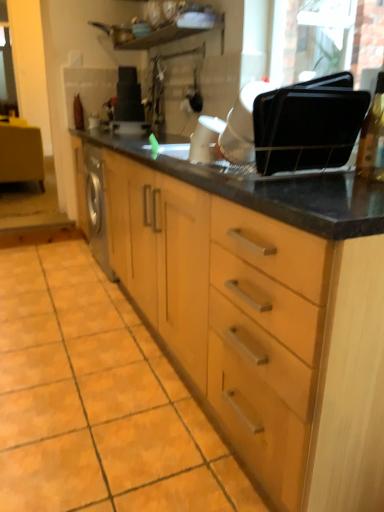
Question: Would you say black matte toaster at upper center, which appears as the third appliance when ordered from the bottom, is part of matte wood vanity at left's contents?

Choices:
 (A) yes
 (B) no

Answer: (B)

Question: Does matte wood vanity at left lie behind black matte toaster at upper center, which appears as the 1th appliance when viewed from the top?

Choices:
 (A) yes
 (B) no

Answer: (A)

Question: Is matte wood vanity at left wider than black matte toaster at upper center, which is the third appliance from front to back?

Choices:
 (A) no
 (B) yes

Answer: (B)

Question: Is the position of matte wood vanity at left less distant than that of black matte toaster at upper center, the 3th appliance positioned from the right?

Choices:
 (A) yes
 (B) no

Answer: (B)

Question: Are matte wood vanity at left and black matte toaster at upper center, the 3th appliance positioned from the right, beside each other?

Choices:
 (A) yes
 (B) no

Answer: (B)

Question: From a real-world perspective, is matte wood vanity at left on black matte toaster at upper center, the 3th appliance positioned from the right?

Choices:
 (A) no
 (B) yes

Answer: (A)

Question: Is white glossy coffee maker at center, placed as the second appliance when sorted from right to left, wider than matte wood vanity at left?

Choices:
 (A) yes
 (B) no

Answer: (B)

Question: Considering the relative sizes of white glossy coffee maker at center, placed as the 2th appliance when sorted from top to bottom, and matte wood vanity at left in the image provided, is white glossy coffee maker at center, placed as the 2th appliance when sorted from top to bottom, taller than matte wood vanity at left?

Choices:
 (A) yes
 (B) no

Answer: (B)

Question: Is white glossy coffee maker at center, the 2th appliance when ordered from back to front, oriented towards matte wood vanity at left?

Choices:
 (A) yes
 (B) no

Answer: (B)

Question: Are white glossy coffee maker at center, placed as the second appliance when sorted from right to left, and matte wood vanity at left beside each other?

Choices:
 (A) no
 (B) yes

Answer: (A)

Question: Does white glossy coffee maker at center, marked as the 2th appliance in a left-to-right arrangement, have a lesser width compared to matte wood vanity at left?

Choices:
 (A) yes
 (B) no

Answer: (A)

Question: Considering the relative positions of white glossy coffee maker at center, marked as the 2th appliance in a left-to-right arrangement, and matte wood vanity at left in the image provided, is white glossy coffee maker at center, marked as the 2th appliance in a left-to-right arrangement, in front of matte wood vanity at left?

Choices:
 (A) yes
 (B) no

Answer: (A)

Question: Considering the relative sizes of black matte toaster at upper center, the first appliance in the left-to-right sequence, and black plastic trays at upper right, arranged as the 1th appliance when ordered from the bottom, in the image provided, is black matte toaster at upper center, the first appliance in the left-to-right sequence, taller than black plastic trays at upper right, arranged as the 1th appliance when ordered from the bottom,?

Choices:
 (A) no
 (B) yes

Answer: (B)